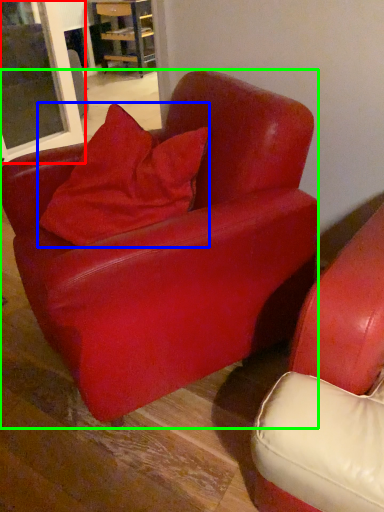
Question: Which object is the farthest from window (highlighted by a red box)? Choose among these: pillow (highlighted by a blue box) or chair (highlighted by a green box).

Choices:
 (A) pillow
 (B) chair

Answer: (B)